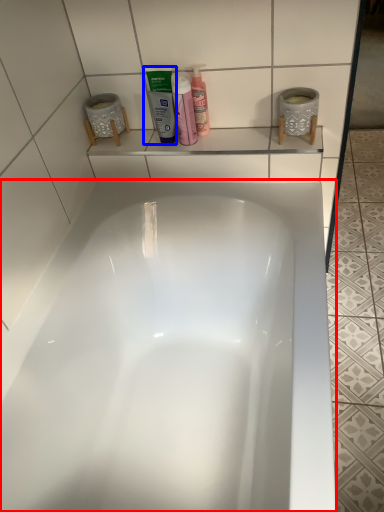
Question: Which of the following is the farthest to the observer, bathtub (highlighted by a red box) or mouthwash (highlighted by a blue box)?

Choices:
 (A) bathtub
 (B) mouthwash

Answer: (B)